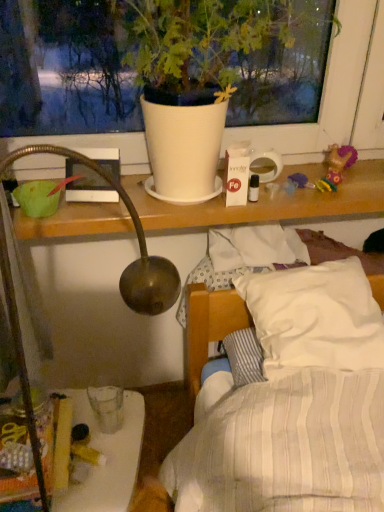
Question: Is translucent plastic glass at lower left at the right side of plush purple doll at upper right?

Choices:
 (A) no
 (B) yes

Answer: (A)

Question: Does translucent plastic glass at lower left have a greater width compared to plush purple doll at upper right?

Choices:
 (A) yes
 (B) no

Answer: (A)

Question: Is translucent plastic glass at lower left bigger than plush purple doll at upper right?

Choices:
 (A) yes
 (B) no

Answer: (A)

Question: Is translucent plastic glass at lower left at the left side of plush purple doll at upper right?

Choices:
 (A) no
 (B) yes

Answer: (B)

Question: Is translucent plastic glass at lower left further to camera compared to plush purple doll at upper right?

Choices:
 (A) no
 (B) yes

Answer: (A)

Question: Considering the positions of point (332, 144) and point (129, 425), is point (332, 144) closer or farther from the camera than point (129, 425)?

Choices:
 (A) closer
 (B) farther

Answer: (B)

Question: From a real-world perspective, is plush purple doll at upper right above or below translucent plastic glass at lower left?

Choices:
 (A) below
 (B) above

Answer: (B)

Question: Is plush purple doll at upper right situated inside translucent plastic glass at lower left or outside?

Choices:
 (A) outside
 (B) inside

Answer: (A)

Question: In the image, is plush purple doll at upper right on the left side or the right side of translucent plastic glass at lower left?

Choices:
 (A) right
 (B) left

Answer: (A)

Question: From the image's perspective, is white matte pot at upper center positioned above or below plush purple doll at upper right?

Choices:
 (A) above
 (B) below

Answer: (A)

Question: From a real-world perspective, is white matte pot at upper center positioned above or below plush purple doll at upper right?

Choices:
 (A) above
 (B) below

Answer: (A)

Question: Is point pyautogui.click(x=180, y=110) closer or farther from the camera than point pyautogui.click(x=329, y=154)?

Choices:
 (A) farther
 (B) closer

Answer: (B)

Question: Visually, is white matte pot at upper center positioned to the left or to the right of plush purple doll at upper right?

Choices:
 (A) right
 (B) left

Answer: (B)

Question: Is translucent plastic glass at lower left in front of or behind plush purple doll at upper right in the image?

Choices:
 (A) front
 (B) behind

Answer: (A)

Question: Is translucent plastic glass at lower left bigger or smaller than plush purple doll at upper right?

Choices:
 (A) big
 (B) small

Answer: (A)